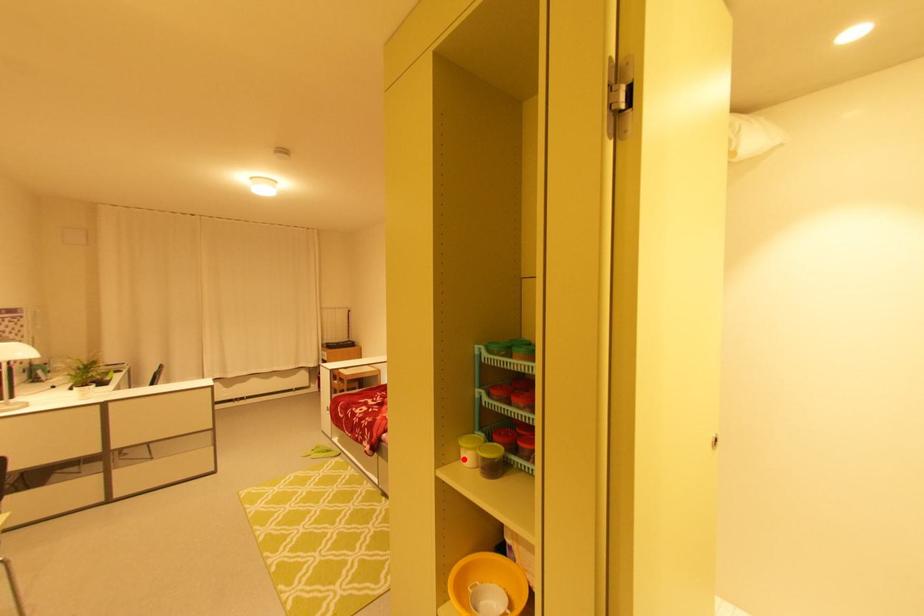
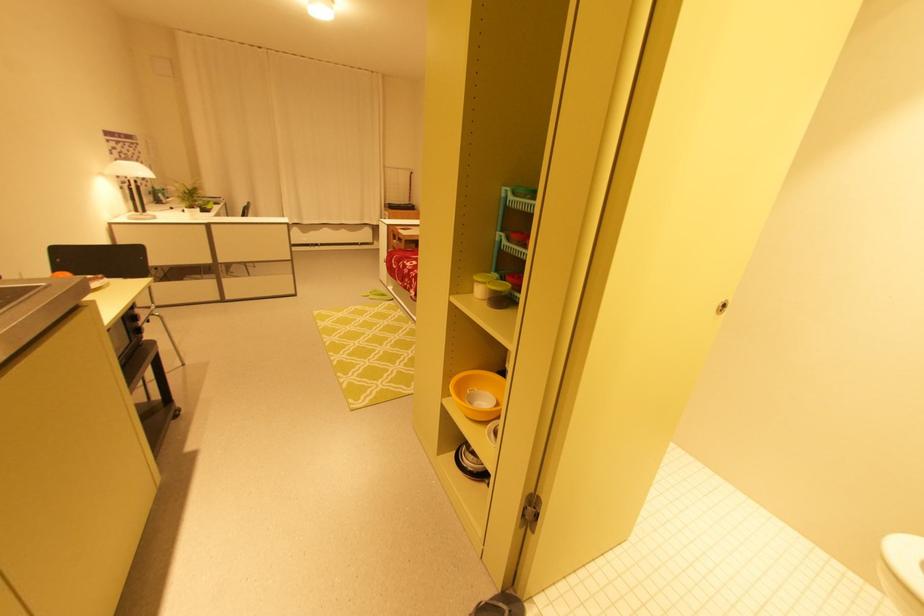
In the second image, find the point that corresponds to the highlighted location in the first image.

(477, 293)